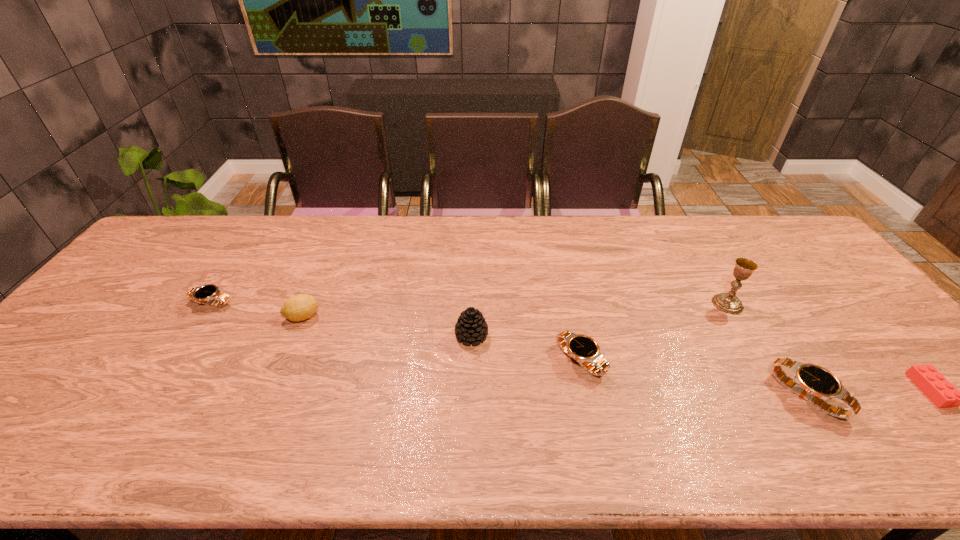
Identify the location of Lego. This screenshot has height=540, width=960. click(930, 381).

The image size is (960, 540). I want to click on free location located 0.320m on the back of the shortest watch, so click(x=258, y=231).

Identify the location of free space located on the right of the second tallest watch. The width and height of the screenshot is (960, 540). (756, 360).

Where is `vacant space located on the right of the rightmost watch`? Image resolution: width=960 pixels, height=540 pixels. vacant space located on the right of the rightmost watch is located at coordinates (930, 396).

This screenshot has height=540, width=960. Find the location of `vacant space located 0.390m at the narrow end of the pinecone`. vacant space located 0.390m at the narrow end of the pinecone is located at coordinates (636, 335).

The width and height of the screenshot is (960, 540). Find the location of `vacant space situated 0.190m at the stem end of the sixth object from right to left`. vacant space situated 0.190m at the stem end of the sixth object from right to left is located at coordinates (390, 316).

This screenshot has width=960, height=540. In order to click on free space located on the front of the tallest object in this screenshot , I will do `click(762, 361)`.

Where is `vacant space located 0.320m on the back of the rightmost object`? vacant space located 0.320m on the back of the rightmost object is located at coordinates (835, 284).

Identify the location of watch at the near edge. Image resolution: width=960 pixels, height=540 pixels. pyautogui.click(x=811, y=382).

Identify the location of Lego that is positioned at the near edge. (930, 381).